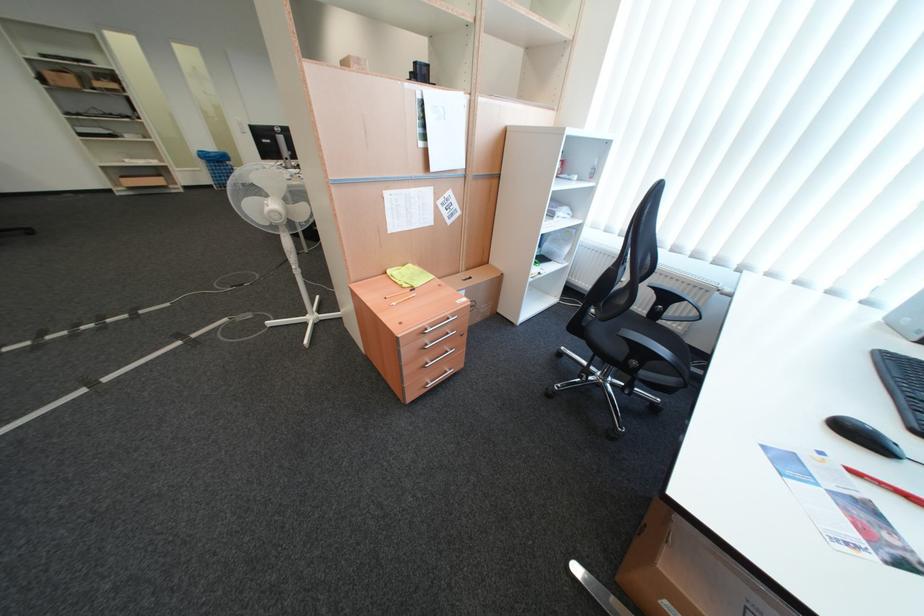
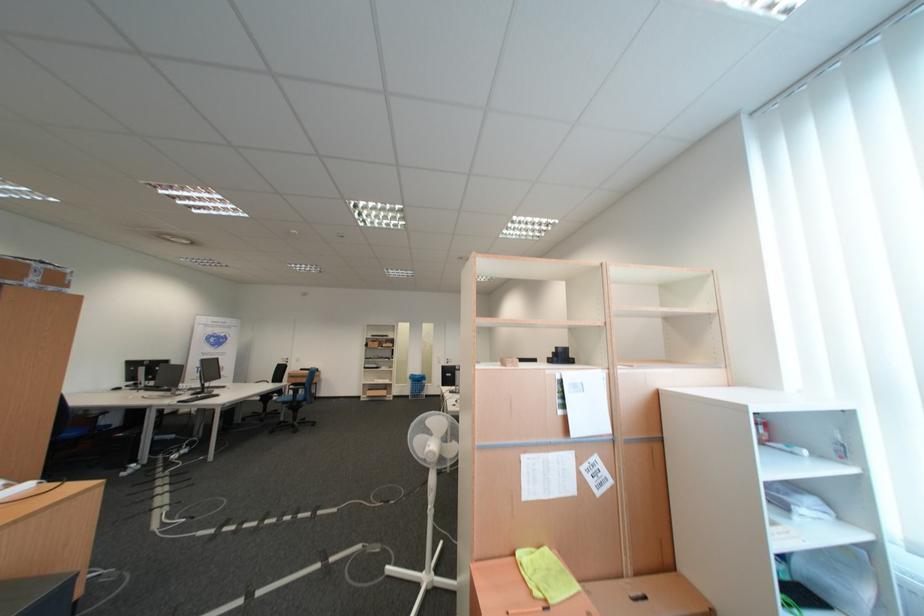
Where in the second image is the point corresponding to (x=397, y=274) from the first image?

(526, 556)